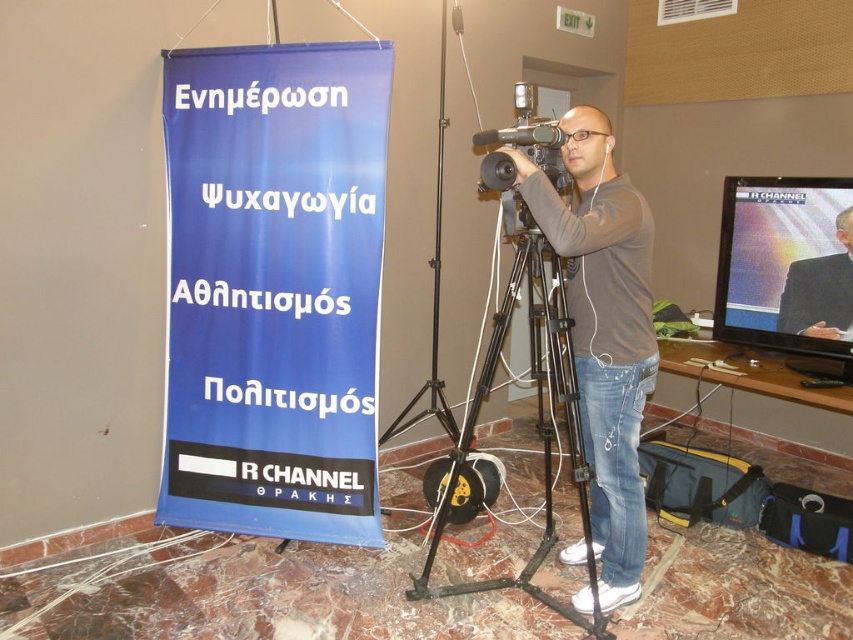
You are setting up equipment in a conference room. You have a black metal tripod at center and a matte black video camera at center. How far apart are these two items?

The black metal tripod at center and matte black video camera at center are 25.93 inches apart.

Looking at this image, you are a photographer in the conference room. You need to position your camera on the black metal tripod at center so that it faces the dark gray suit at upper right. Can you do this without moving the tripod?

Yes, because the black metal tripod at center is already positioned to the left of the dark gray suit at upper right, so the camera can be aimed towards it without moving the tripod.

You are planning to set up a new tripod in this conference room. You have a tripod that is exactly the same width as the dark gray suit at upper right. Can the new tripod fit in the space where the black metal tripod at center is currently placed without overlapping?

The black metal tripod at center is wider than the dark gray suit at upper right. Since your new tripod matches the width of the dark gray suit at upper right, it would be narrower than the existing tripod. Therefore, the new tripod can fit in the space where the black metal tripod at center is placed without overlapping.